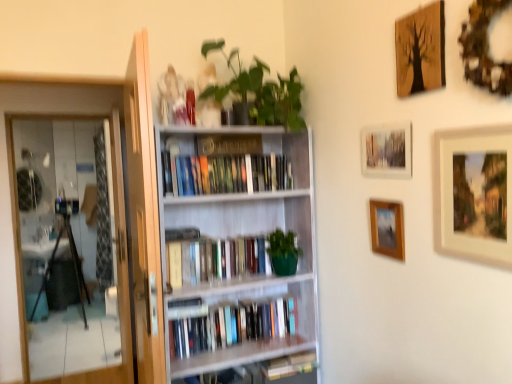
Question: Based on their positions, is green matte plant at upper center located to the left or right of wooden textured picture frame at upper right, arranged as the first picture frame when viewed from the top?

Choices:
 (A) left
 (B) right

Answer: (A)

Question: Is green matte plant at upper center wider or thinner than wooden textured picture frame at upper right, positioned as the 4th picture frame in bottom-to-top order?

Choices:
 (A) thin
 (B) wide

Answer: (B)

Question: Which object is positioned closest to the green matte bookshelf at center, which is counted as the second book, starting from the top?

Choices:
 (A) wooden framed painting at upper right, which is counted as the second picture frame, starting from the bottom
 (B) white wooden bookcase at center
 (C) transparent glass screen door at left
 (D) wooden picture frame at center-right, the first picture frame ordered from the bottom
 (E) hardcover books at center, which is the first book in top-to-bottom order

Answer: (B)

Question: Estimate the real-world distances between objects in this image. Which object is closer to the hardcover books at center, the third book positioned from the top?

Choices:
 (A) green matte plant at upper center
 (B) wooden picture frame at center-right, the first picture frame ordered from the bottom
 (C) wooden framed painting at upper right, which is counted as the 3th picture frame, starting from the top
 (D) hardcover books at center, which is the first book in top-to-bottom order
 (E) green matte bookshelf at center, which is counted as the second book, starting from the top

Answer: (E)